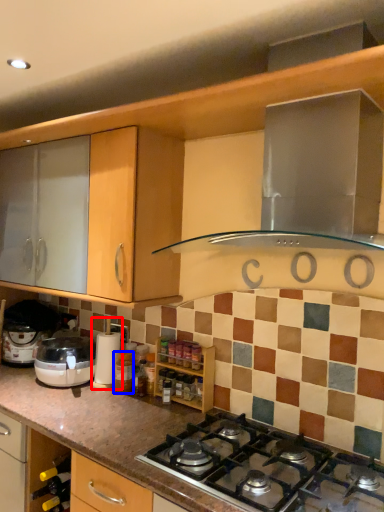
Question: Which object appears farthest to the camera in this image, coffee machine (highlighted by a red box) or bottle (highlighted by a blue box)?

Choices:
 (A) coffee machine
 (B) bottle

Answer: (A)